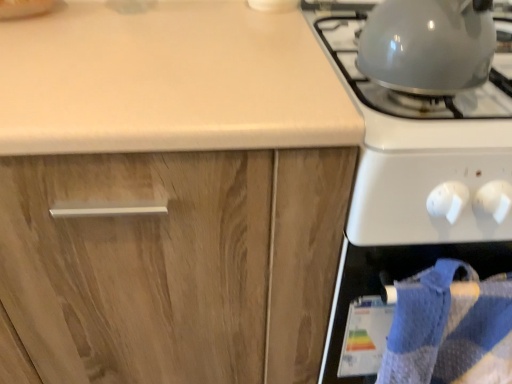
Measure the distance between glossy white gas stove at right, which is the first gas stove from right to left, and camera.

A distance of 49.98 centimeters exists between glossy white gas stove at right, which is the first gas stove from right to left, and camera.

Measure the distance between point (410,109) and camera.

The depth of point (410,109) is 23.90 inches.

Where is `glossy white gas stove at right, the 2th gas stove from the left`? The height and width of the screenshot is (384, 512). glossy white gas stove at right, the 2th gas stove from the left is located at coordinates (426, 122).

Does point (500, 51) lie behind point (487, 255)?

Yes.

Considering the positions of objects shiny metallic kettle at upper right, which is the first gas stove in left-to-right order, and blue textured towel at lower right in the image provided, who is more to the right, shiny metallic kettle at upper right, which is the first gas stove in left-to-right order, or blue textured towel at lower right?

From the viewer's perspective, blue textured towel at lower right appears more on the right side.

You are a GUI agent. You are given a task and a screenshot of the screen. Output one action in this format:
    pyautogui.click(x=<x>, y=<y>)
    Task: Click on the oven below the shiny metallic kettle at upper right, which is the first gas stove in left-to-right order (from the image's perspective)
    The width and height of the screenshot is (512, 384).
    Given the screenshot: What is the action you would take?
    pyautogui.click(x=397, y=278)

Between shiny metallic kettle at upper right, acting as the 2th gas stove starting from the right, and blue textured towel at lower right, which one has smaller width?

Thinner between the two is blue textured towel at lower right.

In terms of height, does wooden cabinet at center look taller or shorter compared to shiny metallic kettle at upper right, which is the first gas stove in left-to-right order?

In the image, wooden cabinet at center appears to be taller than shiny metallic kettle at upper right, which is the first gas stove in left-to-right order.

Is wooden cabinet at center further to camera compared to shiny metallic kettle at upper right, acting as the 2th gas stove starting from the right?

Yes, wooden cabinet at center is behind shiny metallic kettle at upper right, acting as the 2th gas stove starting from the right.

Does wooden cabinet at center have a smaller size compared to shiny metallic kettle at upper right, acting as the 2th gas stove starting from the right?

No.

Considering the positions of points (195, 210) and (412, 103), is point (195, 210) closer to camera compared to point (412, 103)?

Yes.

How different are the orientations of glossy white gas stove at right, the 2th gas stove from the left, and blue textured towel at lower right in degrees?

0.00141 degrees.

Is glossy white gas stove at right, the 2th gas stove from the left, to the left or to the right of blue textured towel at lower right in the image?

Based on their positions, glossy white gas stove at right, the 2th gas stove from the left, is located to the right of blue textured towel at lower right.

Considering the relative sizes of glossy white gas stove at right, which is the first gas stove from right to left, and blue textured towel at lower right in the image provided, is glossy white gas stove at right, which is the first gas stove from right to left, wider than blue textured towel at lower right?

Yes, glossy white gas stove at right, which is the first gas stove from right to left, is wider than blue textured towel at lower right.

Is glossy white gas stove at right, the 2th gas stove from the left, taller than blue textured towel at lower right?

No.

Which of these two, blue textured towel at lower right or shiny metallic kettle at upper right, acting as the 2th gas stove starting from the right, is wider?

shiny metallic kettle at upper right, acting as the 2th gas stove starting from the right, is wider.

You are a GUI agent. You are given a task and a screenshot of the screen. Output one action in this format:
    pyautogui.click(x=<x>, y=<y>)
    Task: Click on the oven that appears on the right of shiny metallic kettle at upper right, acting as the 2th gas stove starting from the right
    The image size is (512, 384).
    Given the screenshot: What is the action you would take?
    pyautogui.click(x=397, y=278)

Which is behind, point (511, 248) or point (379, 98)?

The point (379, 98) is more distant.

Between wooden cabinet at center and blue textured towel at lower right, which one has more height?

With more height is wooden cabinet at center.

Can we say wooden cabinet at center lies outside blue textured towel at lower right?

Yes.

Is the surface of wooden cabinet at center in direct contact with blue textured towel at lower right?

They are not placed beside each other.

From the image's perspective, relative to blue textured towel at lower right, is wooden cabinet at center above or below?

Clearly, from the image's perspective, wooden cabinet at center is above blue textured towel at lower right.

Measure the distance from wooden cabinet at center to glossy white gas stove at right, the 2th gas stove from the left.

The distance of wooden cabinet at center from glossy white gas stove at right, the 2th gas stove from the left, is 9.26 inches.

From the image's perspective, would you say wooden cabinet at center is shown under glossy white gas stove at right, the 2th gas stove from the left?

Yes.

Is wooden cabinet at center inside the boundaries of glossy white gas stove at right, which is the first gas stove from right to left, or outside?

wooden cabinet at center lies outside glossy white gas stove at right, which is the first gas stove from right to left.

Consider the image. Could you tell me if glossy white gas stove at right, the 2th gas stove from the left, is turned towards shiny metallic kettle at upper right, acting as the 2th gas stove starting from the right?

No, glossy white gas stove at right, the 2th gas stove from the left, is not turned towards shiny metallic kettle at upper right, acting as the 2th gas stove starting from the right.

How different are the orientations of glossy white gas stove at right, the 2th gas stove from the left, and shiny metallic kettle at upper right, which is the first gas stove in left-to-right order, in degrees?

The facing directions of glossy white gas stove at right, the 2th gas stove from the left, and shiny metallic kettle at upper right, which is the first gas stove in left-to-right order, are 179 degrees apart.

Who is more distant, glossy white gas stove at right, which is the first gas stove from right to left, or shiny metallic kettle at upper right, acting as the 2th gas stove starting from the right?

shiny metallic kettle at upper right, acting as the 2th gas stove starting from the right.

You are a GUI agent. You are given a task and a screenshot of the screen. Output one action in this format:
    pyautogui.click(x=<x>, y=<y>)
    Task: Click on the 2nd gas stove located above the blue textured towel at lower right (from a real-world perspective)
    
    Given the screenshot: What is the action you would take?
    pyautogui.click(x=400, y=91)

This screenshot has height=384, width=512. Identify the location of cabinetry located on the left of shiny metallic kettle at upper right, acting as the 2th gas stove starting from the right. (175, 264).

Estimate the real-world distances between objects in this image. Which object is closer to blue textured towel at lower right, shiny metallic kettle at upper right, acting as the 2th gas stove starting from the right, or glossy white gas stove at right, the 2th gas stove from the left?

glossy white gas stove at right, the 2th gas stove from the left, is closer to blue textured towel at lower right.

Which object lies nearer to the anchor point blue textured towel at lower right, glossy white gas stove at right, the 2th gas stove from the left, or shiny metallic kettle at upper right, acting as the 2th gas stove starting from the right?

glossy white gas stove at right, the 2th gas stove from the left.

Which object lies nearer to the anchor point shiny metallic kettle at upper right, which is the first gas stove in left-to-right order, wooden cabinet at center or blue textured towel at lower right?

The object closer to shiny metallic kettle at upper right, which is the first gas stove in left-to-right order, is blue textured towel at lower right.

From the image, which object appears to be nearer to blue textured towel at lower right, wooden cabinet at center or glossy white gas stove at right, which is the first gas stove from right to left?

glossy white gas stove at right, which is the first gas stove from right to left, is closer to blue textured towel at lower right.

Which object lies nearer to the anchor point glossy white gas stove at right, the 2th gas stove from the left, wooden cabinet at center or shiny metallic kettle at upper right, which is the first gas stove in left-to-right order?

The object closer to glossy white gas stove at right, the 2th gas stove from the left, is shiny metallic kettle at upper right, which is the first gas stove in left-to-right order.

Looking at the image, which one is located further to blue textured towel at lower right, glossy white gas stove at right, the 2th gas stove from the left, or wooden cabinet at center?

wooden cabinet at center is further to blue textured towel at lower right.

Looking at the image, which one is located further to glossy white gas stove at right, the 2th gas stove from the left, shiny metallic kettle at upper right, which is the first gas stove in left-to-right order, or wooden cabinet at center?

wooden cabinet at center.

Which object lies further to the anchor point wooden cabinet at center, glossy white gas stove at right, which is the first gas stove from right to left, or blue textured towel at lower right?

glossy white gas stove at right, which is the first gas stove from right to left, lies further to wooden cabinet at center than the other object.

In order to click on gas stove between wooden cabinet at center and blue textured towel at lower right in the horizontal direction in this screenshot , I will do `click(400, 91)`.

Locate an element on the screen. gas stove between wooden cabinet at center and glossy white gas stove at right, which is the first gas stove from right to left is located at coordinates click(x=400, y=91).

At what (x,y) coordinates should I click in order to perform the action: click on oven between wooden cabinet at center and glossy white gas stove at right, which is the first gas stove from right to left. Please return your answer as a coordinate pair (x, y). This screenshot has width=512, height=384. Looking at the image, I should click on coord(397,278).

Where is `gas stove between shiny metallic kettle at upper right, acting as the 2th gas stove starting from the right, and blue textured towel at lower right, in the vertical direction`? gas stove between shiny metallic kettle at upper right, acting as the 2th gas stove starting from the right, and blue textured towel at lower right, in the vertical direction is located at coordinates (426, 122).